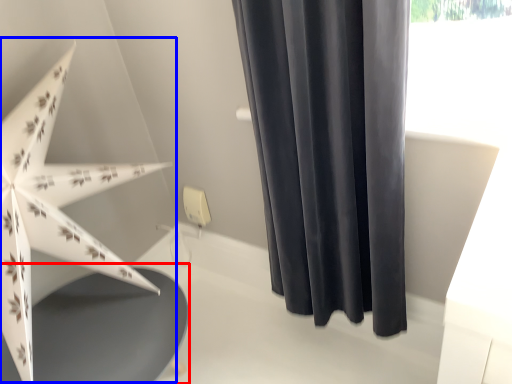
Question: Which point is further to the camera, round table (highlighted by a red box) or umbrella (highlighted by a blue box)?

Choices:
 (A) round table
 (B) umbrella

Answer: (A)